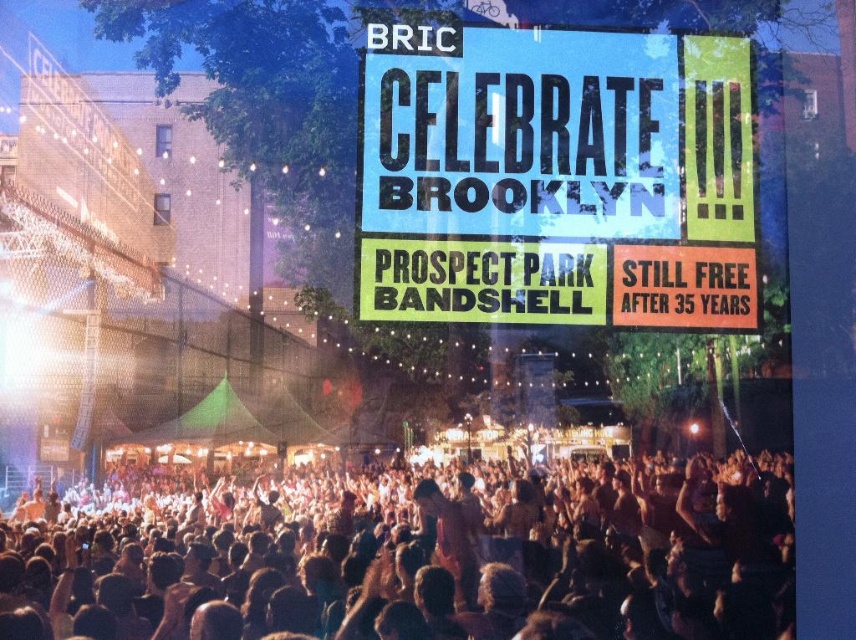
Based on the photo, you are standing at the point labeled as point (716,172) and want to walk to the stage located at point (765,586). Is there a clear path between these two points?

Yes, since point (765,586) is in front of point (716,172), there is a clear path between them.

You are a photographer at the concert and want to capture both the human flesh at center and the blue paper sign at upper center in a single shot. Based on their sizes, do you think they can both fit in the frame?

The human flesh at center might be wider than blue paper sign at upper center, so it depends on the camera angle and zoom level. If the human flesh at center is wider, you may need to adjust your position or zoom out slightly to ensure both fit in the frame.

Based on the scene description, which object is bigger between the human flesh at center and the blue paper sign at upper center?

The human flesh at center is larger in size compared to the blue paper sign at upper center.